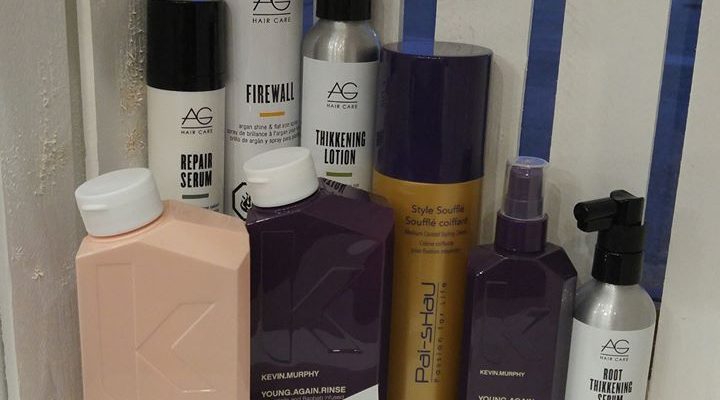
The width and height of the screenshot is (720, 400). Identify the location of wall sections. click(x=629, y=55), click(x=688, y=183), click(x=492, y=25), click(x=381, y=18), click(x=111, y=66), click(x=49, y=94).